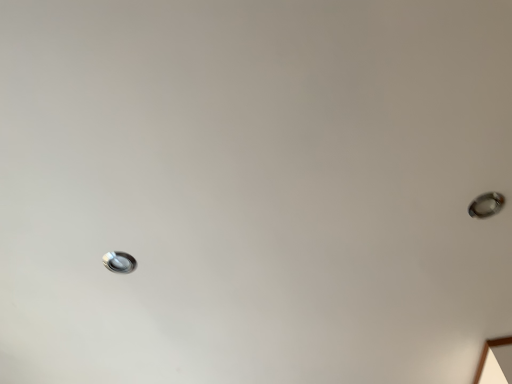
Question: Can you confirm if satin silver droplight at upper right, which is the second droplight from left to right, is positioned to the right of satin silver droplight at lower left, placed as the first droplight when sorted from left to right?

Choices:
 (A) no
 (B) yes

Answer: (B)

Question: Is satin silver droplight at upper right, the 1th droplight viewed from the front, facing away from satin silver droplight at lower left, acting as the 1th droplight starting from the back?

Choices:
 (A) yes
 (B) no

Answer: (A)

Question: From the image's perspective, does satin silver droplight at upper right, which is the second droplight from left to right, appear lower than satin silver droplight at lower left, which is the second droplight in right-to-left order?

Choices:
 (A) no
 (B) yes

Answer: (A)

Question: From a real-world perspective, is satin silver droplight at upper right, the 1th droplight viewed from the front, physically below satin silver droplight at lower left, the 1th droplight ordered from the bottom?

Choices:
 (A) yes
 (B) no

Answer: (A)

Question: Is satin silver droplight at upper right, the 2th droplight from the back, far from satin silver droplight at lower left, the 1th droplight ordered from the bottom?

Choices:
 (A) yes
 (B) no

Answer: (B)

Question: Could you tell me if satin silver droplight at upper right, the 1th droplight viewed from the front, is facing satin silver droplight at lower left, which is the second droplight from top to bottom?

Choices:
 (A) no
 (B) yes

Answer: (A)

Question: Is satin silver droplight at lower left, which is the 2th droplight from front to back, further to camera compared to satin silver droplight at upper right, the 2th droplight from the back?

Choices:
 (A) yes
 (B) no

Answer: (A)

Question: Can you confirm if satin silver droplight at lower left, which is the 2th droplight from front to back, is shorter than satin silver droplight at upper right, which is the second droplight from left to right?

Choices:
 (A) yes
 (B) no

Answer: (A)

Question: Can we say satin silver droplight at lower left, acting as the 1th droplight starting from the back, lies outside satin silver droplight at upper right, which appears as the first droplight when viewed from the top?

Choices:
 (A) no
 (B) yes

Answer: (B)

Question: From the image's perspective, is satin silver droplight at lower left, which is the second droplight in right-to-left order, on satin silver droplight at upper right, which appears as the first droplight when viewed from the top?

Choices:
 (A) no
 (B) yes

Answer: (A)

Question: Is satin silver droplight at lower left, which is the second droplight from top to bottom, surrounding satin silver droplight at upper right, the 2th droplight from the back?

Choices:
 (A) no
 (B) yes

Answer: (A)

Question: From a real-world perspective, is satin silver droplight at lower left, which is the second droplight from top to bottom, located higher than satin silver droplight at upper right, marked as the 2th droplight in a bottom-to-top arrangement?

Choices:
 (A) no
 (B) yes

Answer: (B)

Question: Considering the positions of satin silver droplight at upper right, the 1th droplight viewed from the front, and satin silver droplight at lower left, which is the second droplight in right-to-left order, in the image, is satin silver droplight at upper right, the 1th droplight viewed from the front, wider or thinner than satin silver droplight at lower left, which is the second droplight in right-to-left order,?

Choices:
 (A) wide
 (B) thin

Answer: (A)